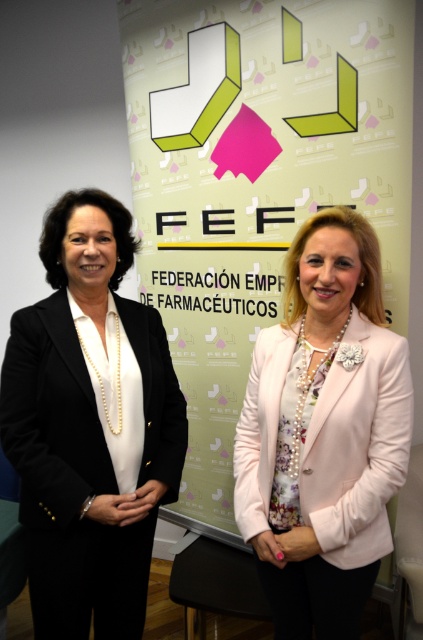
You are a photographer setting up for a professional photoshoot. You need to position a light source to the right of the black matte blazer at left and to the left of the pink satin blazer at center. Is this possible based on their positions?

Yes, since the black matte blazer at left is to the left of the pink satin blazer at center, placing the light source between them would satisfy the requirement of being to the right of the black matte blazer at left and to the left of the pink satin blazer at center.

You are a fashion designer observing the image. You need to determine the exact location of the black matte blazer at left. What are its coordinates?

The coordinates of the black matte blazer at left are at point [90,426].

You are standing 5 feet away from the backdrop. If you walk forward 1 foot, will the black matte blazer at left be closer to you than the backdrop?

The black matte blazer at left is 4.26 feet away from the viewer. If you walk forward 1 foot, your distance to the blazer becomes 3.26 feet. The backdrop is behind the women, so it would be farther away than the blazer. Therefore, yes, the black matte blazer at left will be closer to you than the backdrop after moving forward.